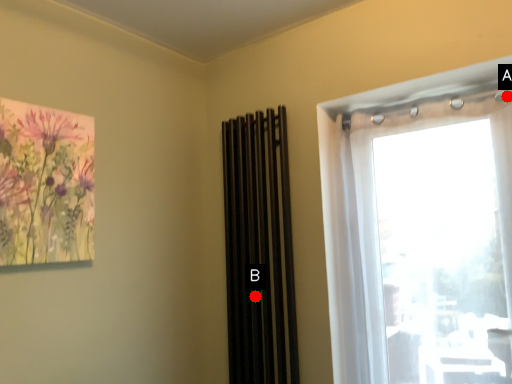
Question: Two points are circled on the image, labeled by A and B beside each circle. Which point is closer to the camera taking this photo?

Choices:
 (A) A is closer
 (B) B is closer

Answer: (A)